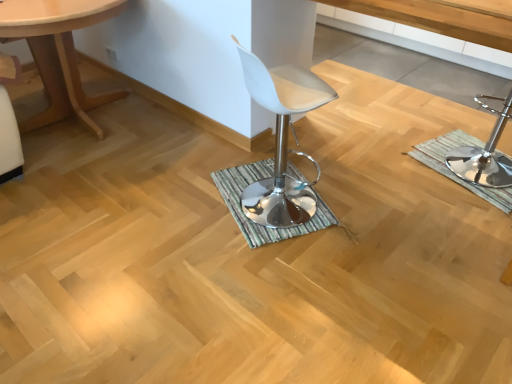
The image size is (512, 384). What are the coordinates of `vacant space underneath white plastic stool at center (from a real-world perspective)` in the screenshot? It's located at (393, 182).